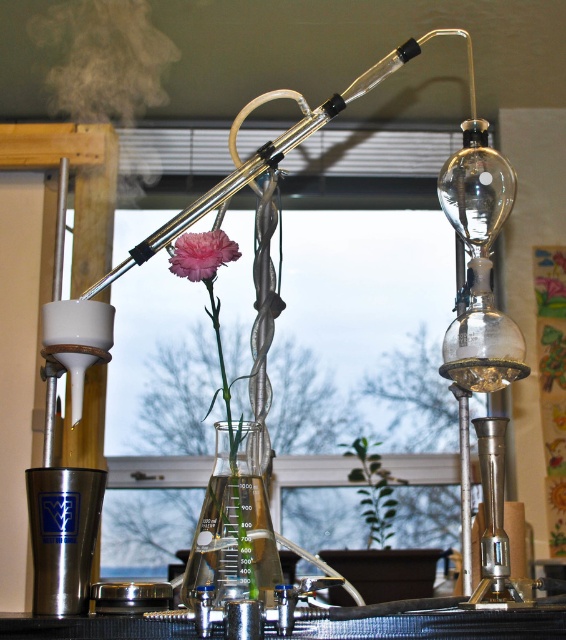
Which is behind, point (218, 563) or point (225, 234)?

Point (218, 563)

Which is in front, point (247, 449) or point (169, 259)?

Point (169, 259) is in front.

Find the location of `transparent glass beaker at center`. transparent glass beaker at center is located at coordinates (233, 524).